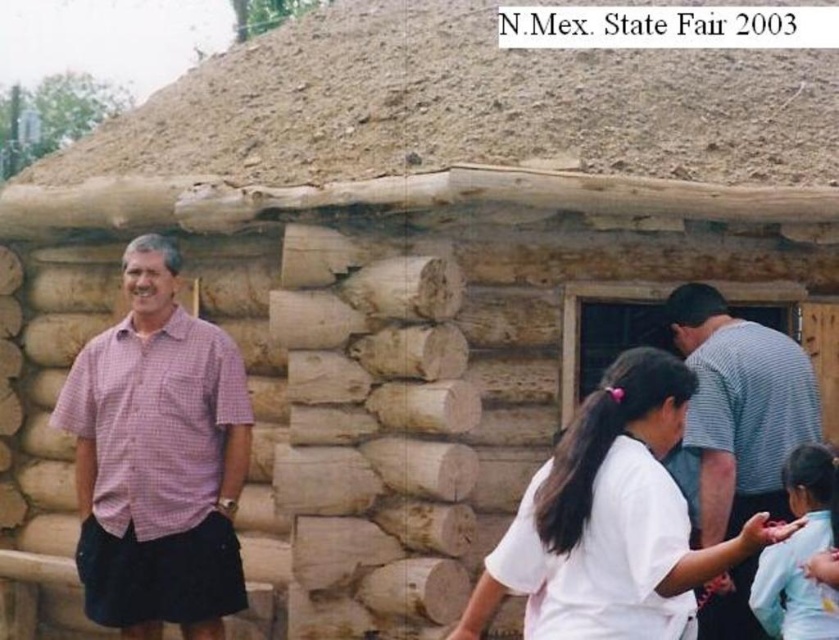
Question: Among these points, which one is nearest to the camera?

Choices:
 (A) (723, 401)
 (B) (532, 490)

Answer: (B)

Question: Can you confirm if white matte shirt at center is bigger than gray striped shirt at right?

Choices:
 (A) yes
 (B) no

Answer: (B)

Question: Does gray striped shirt at right appear on the right side of light blue shirt at lower right?

Choices:
 (A) no
 (B) yes

Answer: (A)

Question: Which point appears closest to the camera in this image?

Choices:
 (A) (811, 500)
 (B) (532, 625)
 (C) (89, 577)

Answer: (B)

Question: Which of the following is the closest to the observer?

Choices:
 (A) light blue shirt at lower right
 (B) gray striped shirt at right

Answer: (A)

Question: Is gray striped shirt at right further to the viewer compared to light blue shirt at lower right?

Choices:
 (A) yes
 (B) no

Answer: (A)